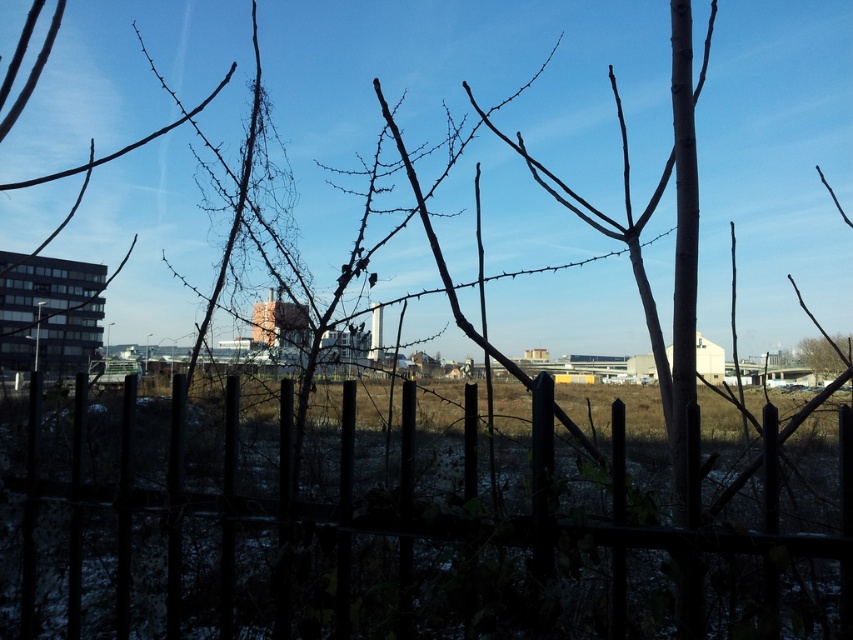
You are standing in front of the scene described. You need to locate the black metal fence at lower center. According to the coordinates provided, where exactly is it positioned?

The black metal fence at lower center is positioned at coordinates point (392, 529).

You are a delivery drone that needs to fly through the space between the black metal fence at lower center and the brown rough tree at right. The drone has a wingspan of 3.5 feet. Can it safely pass through the gap without touching either object?

The gap between the black metal fence at lower center and the brown rough tree at right is 4.52 feet. Since the drone has a wingspan of 3.5 feet, it can safely pass through the gap as there is enough space between the two objects.

You are standing in front of the metal fence with vertical bars. There is a point marked at coordinates [392,529]. Which object is this point located on?

The point at [392,529] is located on the black metal fence at lower center.